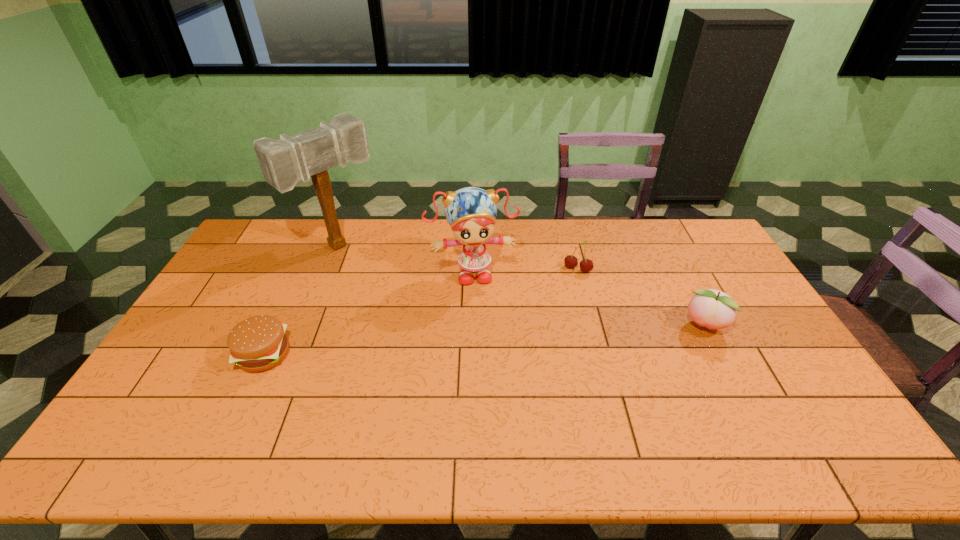
Where is `blank area in the image that satisfies the following two spatial constraints: 1. on the back side of the third object from right to left; 2. on the right side of the fourth object from left to right`? Image resolution: width=960 pixels, height=540 pixels. blank area in the image that satisfies the following two spatial constraints: 1. on the back side of the third object from right to left; 2. on the right side of the fourth object from left to right is located at coordinates pos(472,269).